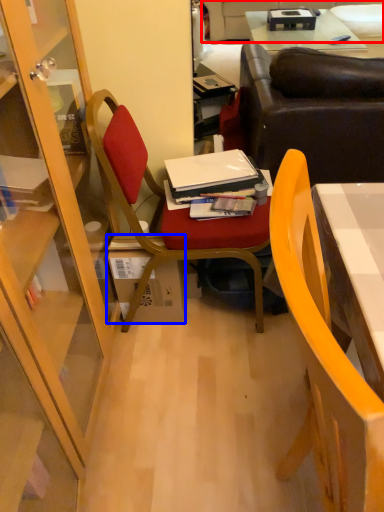
Question: Which of the following is the closest to the observer, couch (highlighted by a red box) or box (highlighted by a blue box)?

Choices:
 (A) couch
 (B) box

Answer: (B)